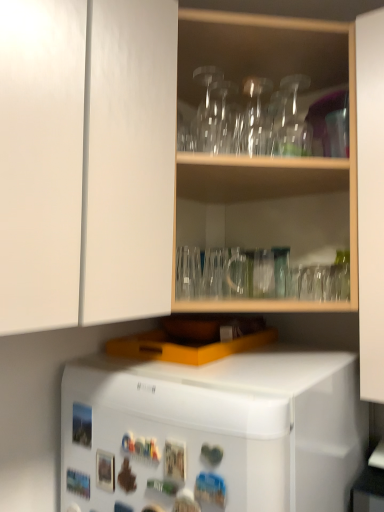
Question: Should I look upward or downward to see transparent glass vase at upper center, which appears as the 1th glass vase when viewed from the left?

Choices:
 (A) up
 (B) down

Answer: (A)

Question: From a real-world perspective, is white matte refrigerator at lower center beneath transparent glass vase at upper center, the second glass vase positioned from the front?

Choices:
 (A) no
 (B) yes

Answer: (B)

Question: Does white matte refrigerator at lower center lie in front of transparent glass vase at upper center, which is the 2th glass vase from right to left?

Choices:
 (A) no
 (B) yes

Answer: (B)

Question: Does white matte refrigerator at lower center have a lesser width compared to transparent glass vase at upper center, the second glass vase positioned from the front?

Choices:
 (A) no
 (B) yes

Answer: (A)

Question: Can transparent glass vase at upper center, the second glass vase positioned from the front, be found inside white matte refrigerator at lower center?

Choices:
 (A) yes
 (B) no

Answer: (B)

Question: Considering the relative sizes of white matte refrigerator at lower center and transparent glass vase at upper center, which ranks as the first glass vase in back-to-front order, in the image provided, is white matte refrigerator at lower center wider than transparent glass vase at upper center, which ranks as the first glass vase in back-to-front order,?

Choices:
 (A) yes
 (B) no

Answer: (A)

Question: From a real-world perspective, is white matte refrigerator at lower center physically above transparent glass vase at upper center, which appears as the 1th glass vase when viewed from the left?

Choices:
 (A) yes
 (B) no

Answer: (B)

Question: Would you consider transparent glassware at upper center to be distant from transparent glass vase at upper center, marked as the 1th glass vase in a right-to-left arrangement?

Choices:
 (A) yes
 (B) no

Answer: (B)

Question: Is transparent glassware at upper center bigger than transparent glass vase at upper center, which ranks as the 1th glass vase in front-to-back order?

Choices:
 (A) no
 (B) yes

Answer: (B)

Question: Is transparent glassware at upper center in contact with transparent glass vase at upper center, positioned as the second glass vase in left-to-right order?

Choices:
 (A) no
 (B) yes

Answer: (A)

Question: Is transparent glassware at upper center positioned beyond the bounds of transparent glass vase at upper center, arranged as the second glass vase when viewed from the back?

Choices:
 (A) yes
 (B) no

Answer: (A)

Question: Can you confirm if transparent glassware at upper center is positioned to the right of transparent glass vase at upper center, positioned as the second glass vase in left-to-right order?

Choices:
 (A) no
 (B) yes

Answer: (A)

Question: From a real-world perspective, is transparent glassware at upper center beneath transparent glass vase at upper center, marked as the 1th glass vase in a right-to-left arrangement?

Choices:
 (A) yes
 (B) no

Answer: (A)

Question: Is transparent glass vase at upper center, which appears as the 1th glass vase when viewed from the left, positioned before transparent glassware at upper center?

Choices:
 (A) no
 (B) yes

Answer: (A)